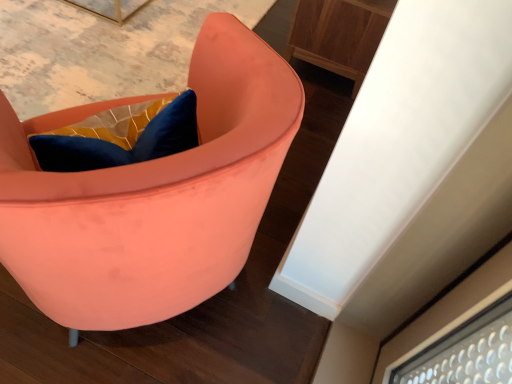
Question: From their relative heights in the image, would you say matte coral chair at center is taller or shorter than wooden cabinet at upper right?

Choices:
 (A) short
 (B) tall

Answer: (B)

Question: Based on their sizes in the image, would you say matte coral chair at center is bigger or smaller than wooden cabinet at upper right?

Choices:
 (A) small
 (B) big

Answer: (B)

Question: Relative to wooden cabinet at upper right, is matte coral chair at center in front or behind?

Choices:
 (A) behind
 (B) front

Answer: (B)

Question: Relative to matte coral chair at center, is wooden cabinet at upper right in front or behind?

Choices:
 (A) behind
 (B) front

Answer: (A)

Question: Based on their sizes in the image, would you say wooden cabinet at upper right is bigger or smaller than matte coral chair at center?

Choices:
 (A) big
 (B) small

Answer: (B)

Question: Considering the relative positions of wooden cabinet at upper right and matte coral chair at center in the image provided, is wooden cabinet at upper right to the left or to the right of matte coral chair at center?

Choices:
 (A) left
 (B) right

Answer: (B)

Question: From a real-world perspective, is wooden cabinet at upper right positioned above or below matte coral chair at center?

Choices:
 (A) above
 (B) below

Answer: (B)